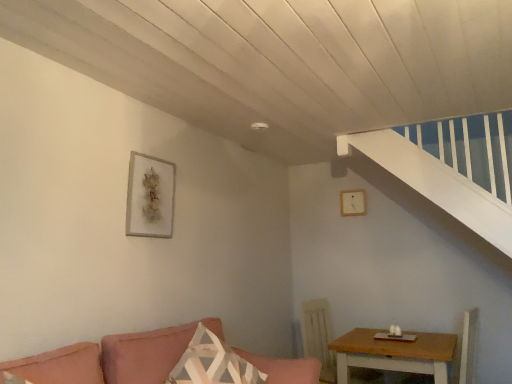
Question: Choose the correct answer: Is matte gray picture frame at upper left, the first picture frame in the front-to-back sequence, inside pink fabric couch at lower left or outside it?

Choices:
 (A) outside
 (B) inside

Answer: (A)

Question: Considering their positions, is matte gray picture frame at upper left, marked as the second picture frame in a right-to-left arrangement, located in front of or behind pink fabric couch at lower left?

Choices:
 (A) behind
 (B) front

Answer: (A)

Question: Estimate the real-world distances between objects in this image. Which object is closer to the light brown wooden table at lower right?

Choices:
 (A) matte gray picture frame at upper left, marked as the 2th picture frame in a back-to-front arrangement
 (B) patterned fabric pillow at center
 (C) matte white picture frame at upper center, which is the second picture frame from front to back
 (D) pink fabric couch at lower left

Answer: (D)

Question: Based on their relative distances, which object is farther from the pink fabric couch at lower left?

Choices:
 (A) matte gray picture frame at upper left, marked as the second picture frame in a right-to-left arrangement
 (B) matte white picture frame at upper center, which is the second picture frame from front to back
 (C) patterned fabric pillow at center
 (D) light brown wooden table at lower right

Answer: (B)